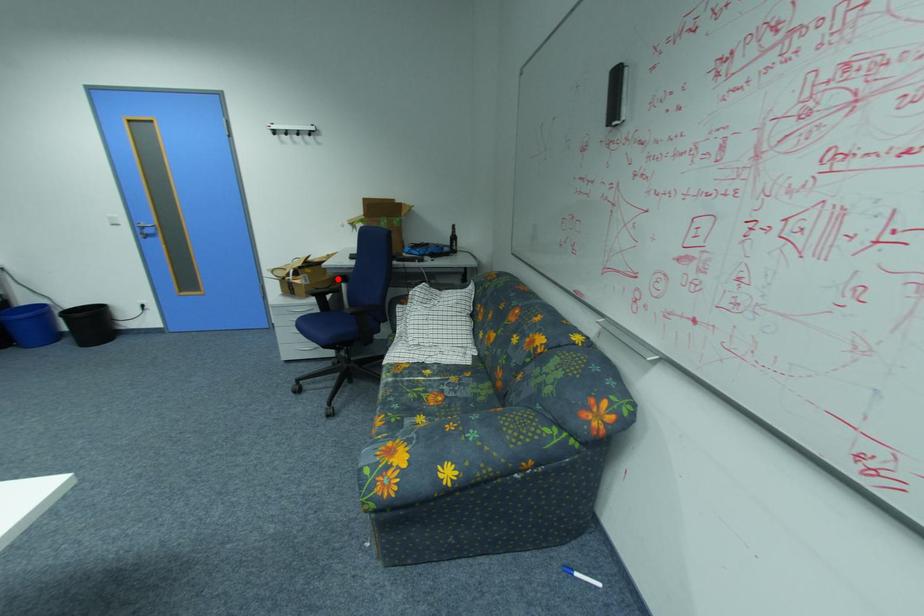
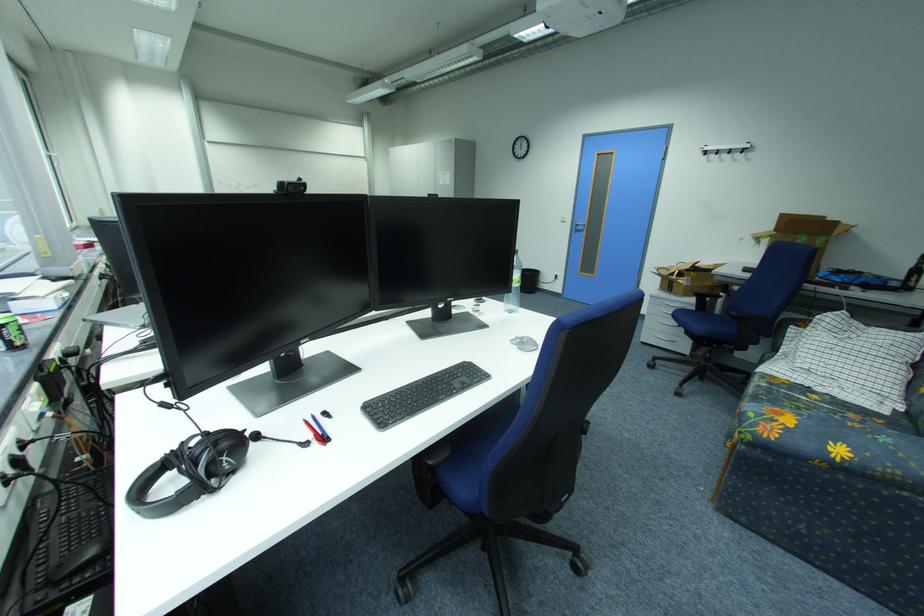
Locate, in the second image, the point that corresponds to the highlighted location in the first image.

(718, 286)